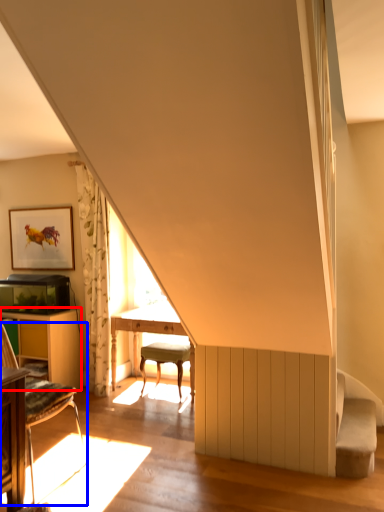
Question: Among these objects, which one is farthest to the camera, table (highlighted by a red box) or chair (highlighted by a blue box)?

Choices:
 (A) table
 (B) chair

Answer: (A)